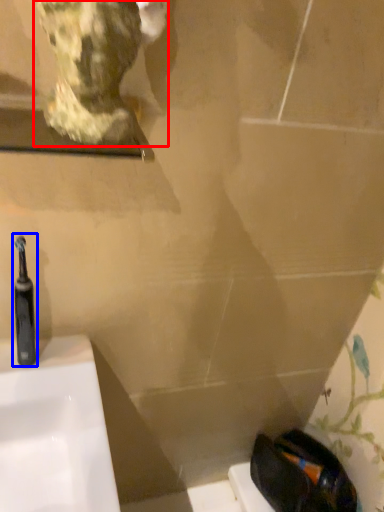
Question: Which of the following is the closest to the observer, sculpture (highlighted by a red box) or toothbrush (highlighted by a blue box)?

Choices:
 (A) sculpture
 (B) toothbrush

Answer: (A)